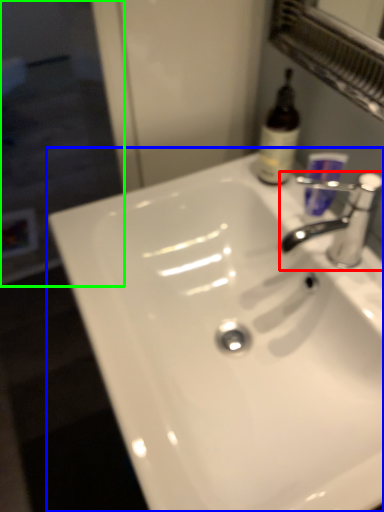
Question: Estimate the real-world distances between objects in this image. Which object is closer to tap (highlighted by a red box), sink (highlighted by a blue box) or screen door (highlighted by a green box)?

Choices:
 (A) sink
 (B) screen door

Answer: (A)